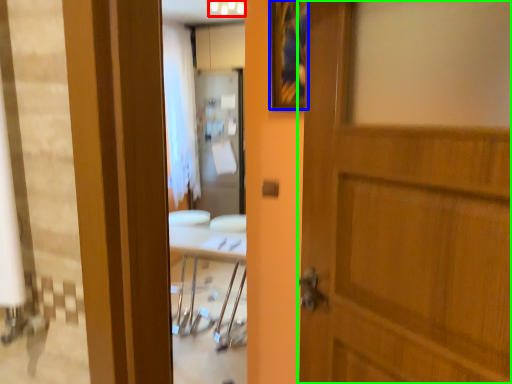
Question: Which object is positioned farthest from light fixture (highlighted by a red box)? Select from picture frame (highlighted by a blue box) and door (highlighted by a green box).

Choices:
 (A) picture frame
 (B) door

Answer: (B)